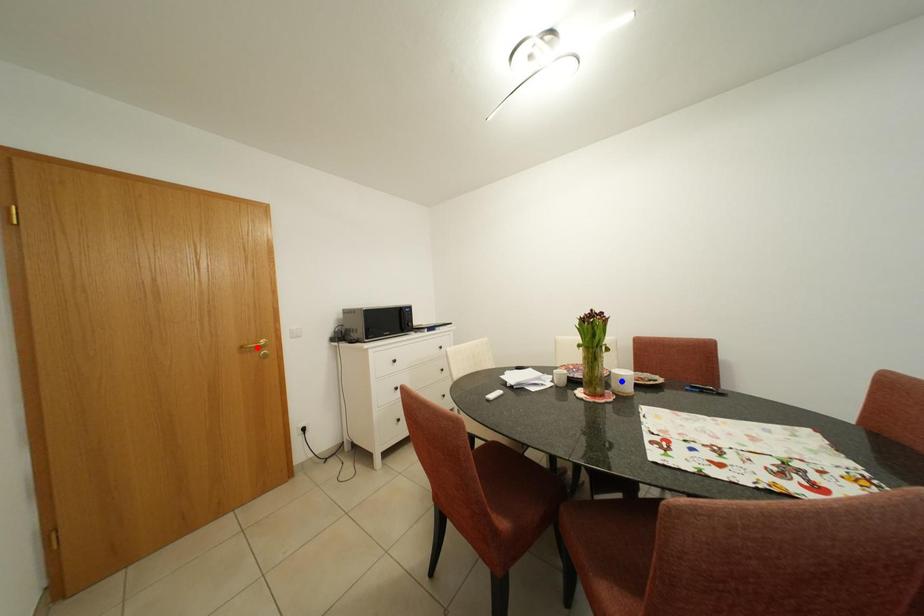
Question: Two points are marked on the image. Which point is closer to the camera?

Choices:
 (A) Blue point is closer.
 (B) Red point is closer.

Answer: (A)